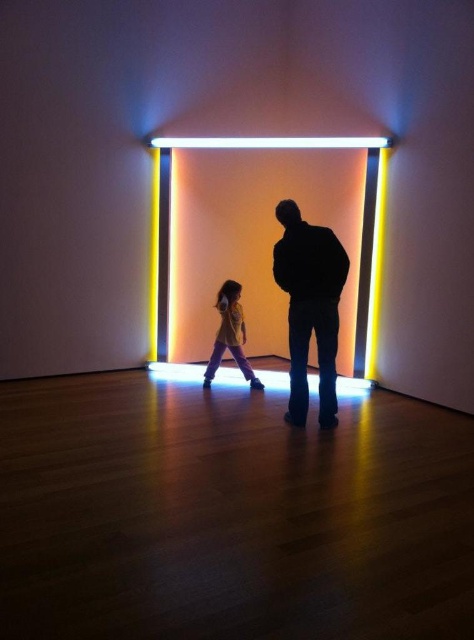
Is white fluorescent tube at center to the left of yellow cotton shirt at center from the viewer's perspective?

In fact, white fluorescent tube at center is to the right of yellow cotton shirt at center.

Does point (166, 179) lie in front of point (220, 349)?

That is False.

Locate an element on the screen. white fluorescent tube at center is located at coordinates (261, 148).

Describe the element at coordinates (309, 307) in the screenshot. The image size is (474, 640). I see `black matte jacket at center` at that location.

Between black matte jacket at center and white fluorescent tube at center, which one is positioned higher?

Positioned higher is white fluorescent tube at center.

Where is `black matte jacket at center`? Image resolution: width=474 pixels, height=640 pixels. black matte jacket at center is located at coordinates (309, 307).

Is point (294, 349) closer to viewer compared to point (230, 323)?

That is True.

The width and height of the screenshot is (474, 640). In order to click on black matte jacket at center in this screenshot , I will do `click(309, 307)`.

Does point (309, 246) come closer to viewer compared to point (230, 304)?

That is True.

Where is `black matte jacket at center`? The width and height of the screenshot is (474, 640). black matte jacket at center is located at coordinates (309, 307).